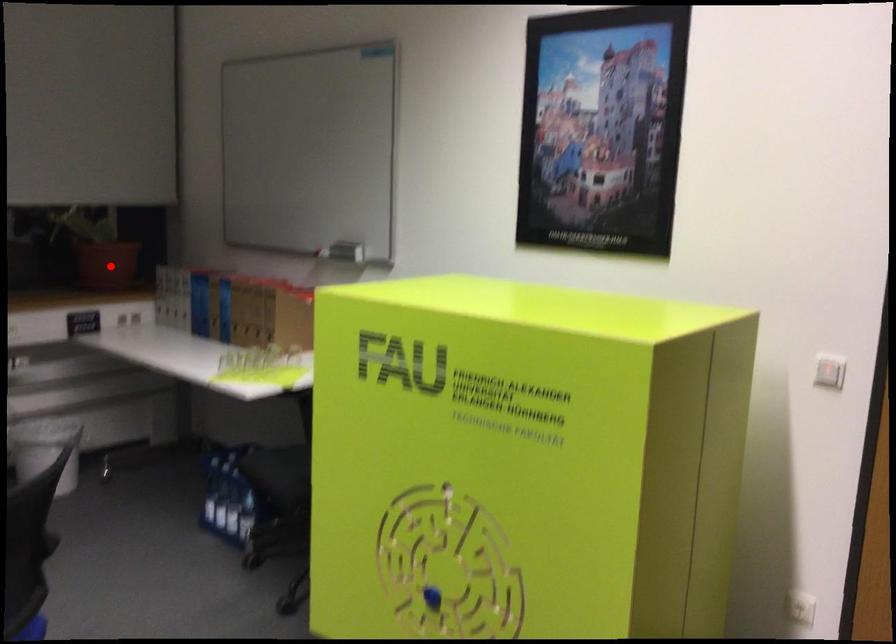
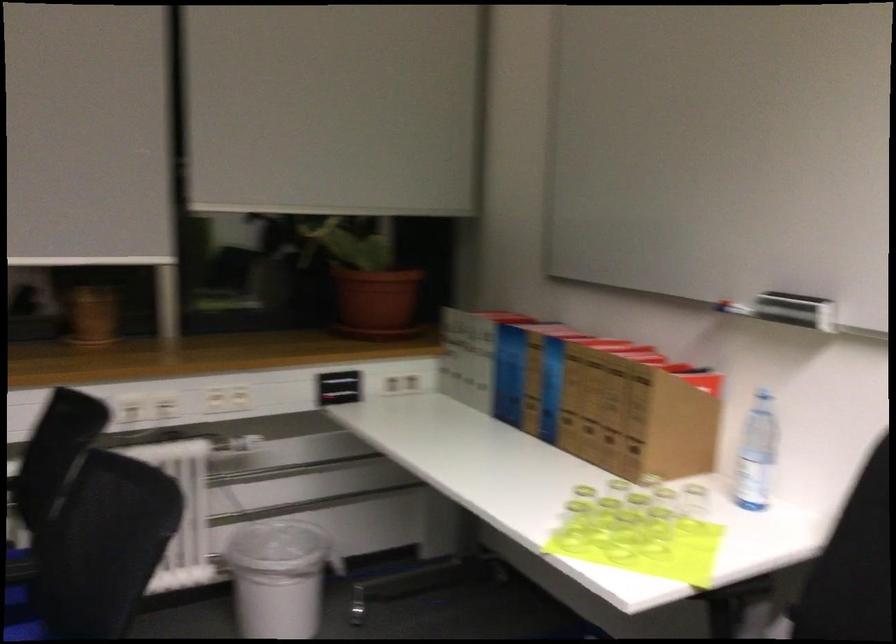
The point at the highlighted location is marked in the first image. Where is the corresponding point in the second image?

(375, 303)